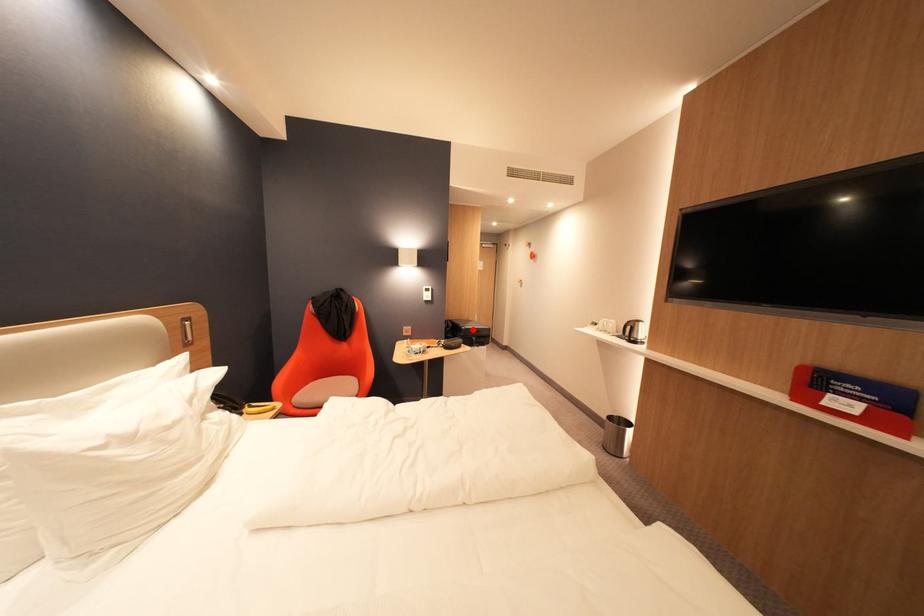
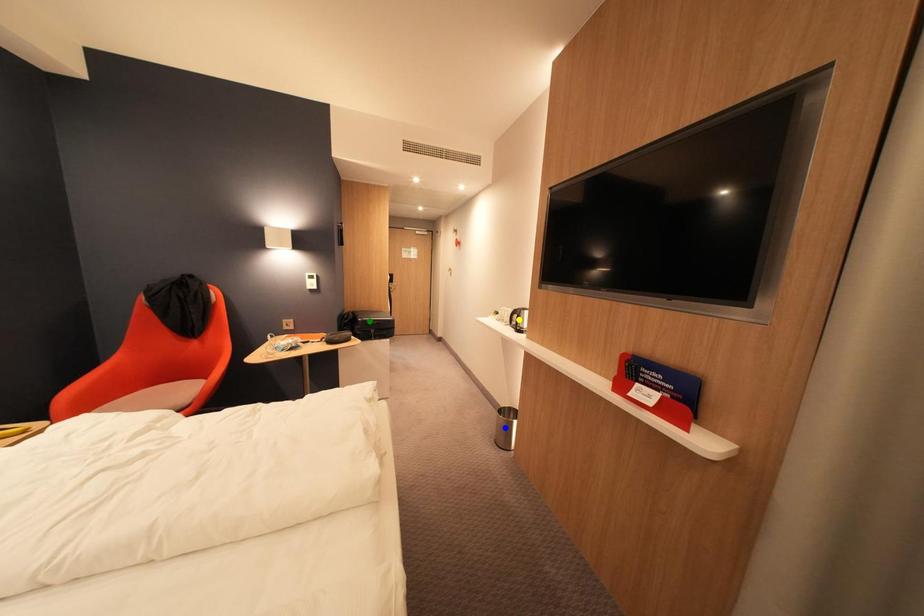
Question: I am providing you with two images of the same scene from different viewpoints. A red point is marked on the first image. You are given multiple points on the second image. Can you choose the point in image 2 that corresponds to the point in image 1?

Choices:
 (A) yellow point
 (B) blue point
 (C) green point

Answer: (C)